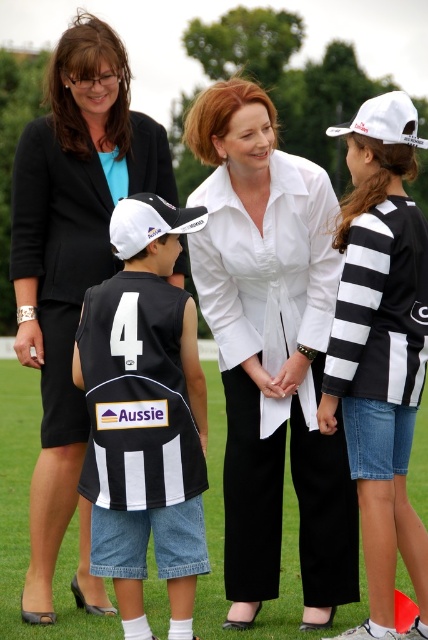
You are a photographer setting up for a group photo. You need to ensure that the matte black blazer at upper left and the white matte baseball cap at upper right are both visible in the frame. Based on their sizes, which object might require you to adjust your camera angle to prevent it from being cropped out?

The white matte baseball cap at upper right might require adjusting the camera angle because it occupies more space than the matte black blazer at upper left, making it more likely to be cropped if not positioned carefully.

You are a photographer trying to capture the scene with the matte black blazer at upper left and the white matte baseball cap at upper right. Which object should you focus on first if you want to take a photo that includes both in the frame without moving the camera?

The matte black blazer at upper left is located below the white matte baseball cap at upper right. Since the blazer is lower, you should focus on the white matte baseball cap at upper right first to ensure both are in frame without moving the camera.

You are a photographer trying to capture a clear shot of the white smooth shirt at center and the white matte baseball cap at upper right. Based on their positions, which object should you focus on first to ensure both are in frame?

The white smooth shirt at center is below white matte baseball cap at upper right, so you should focus on the white matte baseball cap at upper right first to ensure both are in frame.